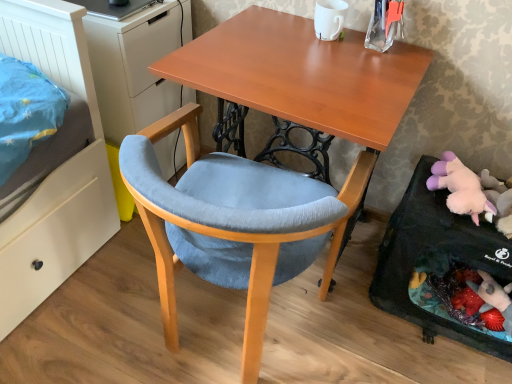
Question: Does velvet blue chair at center have a lesser width compared to matte white dresser at left?

Choices:
 (A) no
 (B) yes

Answer: (A)

Question: Considering the relative positions of velvet blue chair at center and matte white dresser at left in the image provided, is velvet blue chair at center to the right of matte white dresser at left from the viewer's perspective?

Choices:
 (A) yes
 (B) no

Answer: (A)

Question: Is velvet blue chair at center completely or partially outside of matte white dresser at left?

Choices:
 (A) yes
 (B) no

Answer: (A)

Question: Is velvet blue chair at center aimed at matte white dresser at left?

Choices:
 (A) yes
 (B) no

Answer: (B)

Question: Is velvet blue chair at center further to the viewer compared to matte white dresser at left?

Choices:
 (A) yes
 (B) no

Answer: (B)

Question: From the image's perspective, does velvet blue chair at center appear lower than matte white dresser at left?

Choices:
 (A) no
 (B) yes

Answer: (B)

Question: Does velvet blue chair at center lie in front of fluffy pink plush at lower right?

Choices:
 (A) yes
 (B) no

Answer: (A)

Question: Is velvet blue chair at center far from fluffy pink plush at lower right?

Choices:
 (A) no
 (B) yes

Answer: (A)

Question: Is velvet blue chair at center placed right next to fluffy pink plush at lower right?

Choices:
 (A) yes
 (B) no

Answer: (B)

Question: Is velvet blue chair at center outside of fluffy pink plush at lower right?

Choices:
 (A) yes
 (B) no

Answer: (A)

Question: Considering the relative sizes of velvet blue chair at center and fluffy pink plush at lower right in the image provided, is velvet blue chair at center wider than fluffy pink plush at lower right?

Choices:
 (A) yes
 (B) no

Answer: (A)

Question: From the image's perspective, is velvet blue chair at center located beneath fluffy pink plush at lower right?

Choices:
 (A) no
 (B) yes

Answer: (B)

Question: Can you confirm if matte white dresser at left is positioned to the left of fluffy pink plush at lower right?

Choices:
 (A) no
 (B) yes

Answer: (B)